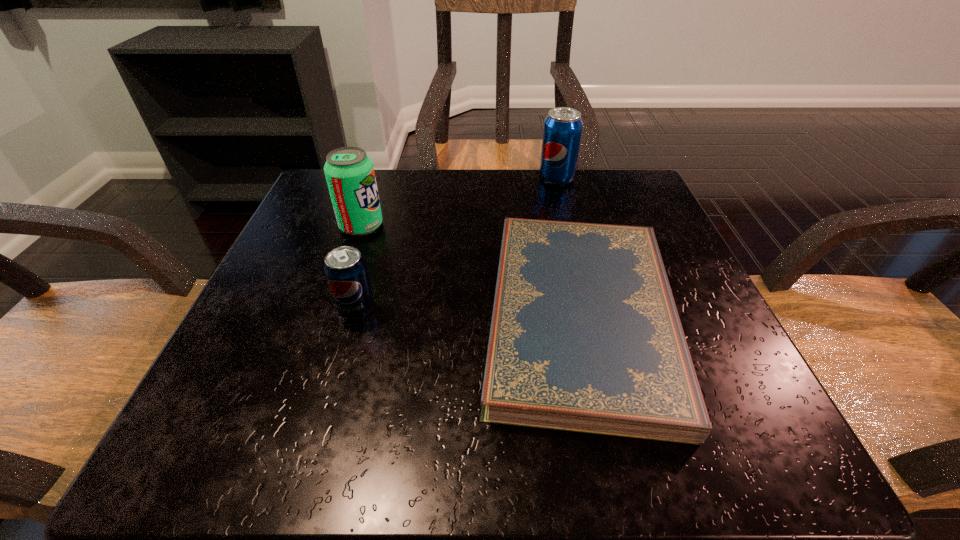
Where is `object that is at the near edge`? This screenshot has width=960, height=540. object that is at the near edge is located at coordinates (585, 336).

You are a GUI agent. You are given a task and a screenshot of the screen. Output one action in this format:
    pyautogui.click(x=<x>, y=<y>)
    Task: Click on the pop soda present at the right edge
    The width and height of the screenshot is (960, 540).
    Given the screenshot: What is the action you would take?
    pyautogui.click(x=562, y=130)

Locate an element on the screen. paperback book present at the right edge is located at coordinates (585, 336).

What are the coordinates of `object located at the far left corner` in the screenshot? It's located at tap(349, 172).

You are a GUI agent. You are given a task and a screenshot of the screen. Output one action in this format:
    pyautogui.click(x=<x>, y=<y>)
    Task: Click on the object that is positioned at the far right corner
    This screenshot has width=960, height=540.
    Given the screenshot: What is the action you would take?
    pyautogui.click(x=562, y=130)

I want to click on object located at the near right corner, so click(x=585, y=336).

Identify the location of free region at the far edge of the desktop. The height and width of the screenshot is (540, 960). pyautogui.click(x=425, y=176).

Locate an element on the screen. vacant space at the near edge is located at coordinates (527, 450).

Locate an element on the screen. free space at the left edge of the desktop is located at coordinates (328, 237).

This screenshot has width=960, height=540. In order to click on vacant space at the right edge in this screenshot , I will do `click(692, 286)`.